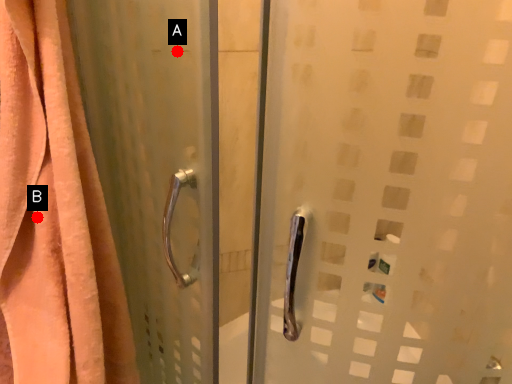
Question: Two points are circled on the image, labeled by A and B beside each circle. Which of the following is the closest to the observer?

Choices:
 (A) A is closer
 (B) B is closer

Answer: (A)